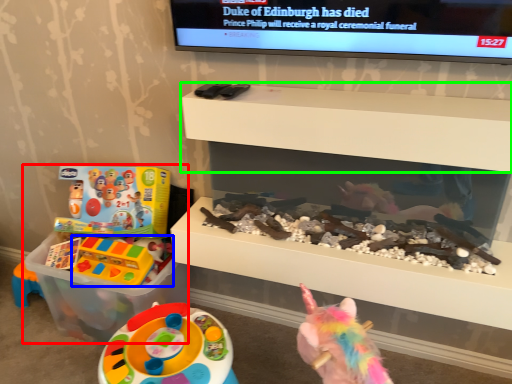
Question: Estimate the real-world distances between objects in this image. Which object is closer to toy (highlighted by a red box), toy (highlighted by a blue box) or shelf (highlighted by a green box)?

Choices:
 (A) toy
 (B) shelf

Answer: (A)